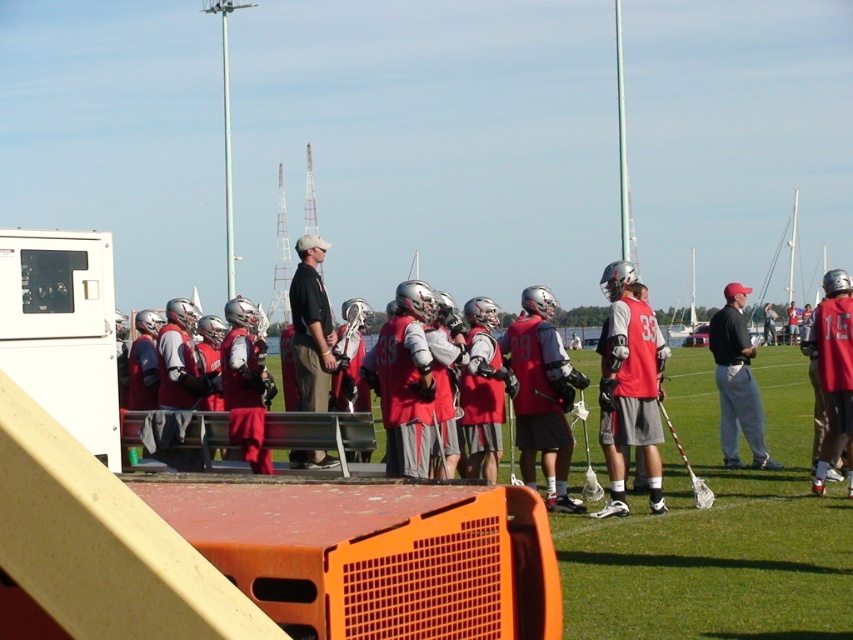
Is red matte jersey at center taller than matte red lacrosse uniform at center?

In fact, red matte jersey at center may be shorter than matte red lacrosse uniform at center.

Which is behind, point (610, 497) or point (648, 314)?

The point (610, 497) is more distant.

Find the location of a particular element. red matte jersey at center is located at coordinates (627, 413).

Who is taller, matte red lacrosse uniform at center or black smooth shirt at center?

Standing taller between the two is matte red lacrosse uniform at center.

Identify the location of matte red lacrosse uniform at center. (628, 387).

Does red matte jersey at center appear under matte black shirt at center?

Indeed, red matte jersey at center is positioned under matte black shirt at center.

Describe the element at coordinates (627, 413) in the screenshot. Image resolution: width=853 pixels, height=640 pixels. I see `red matte jersey at center` at that location.

Describe the element at coordinates (627, 413) in the screenshot. This screenshot has width=853, height=640. I see `red matte jersey at center` at that location.

Where is `red matte jersey at center`? The image size is (853, 640). red matte jersey at center is located at coordinates (627, 413).